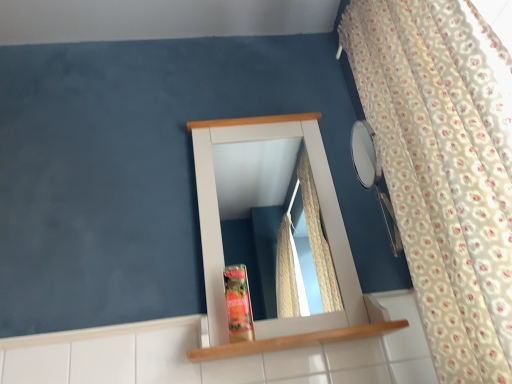
In order to click on free location above white glossy mirror at center (from a real-world perspective) in this screenshot , I will do `click(181, 57)`.